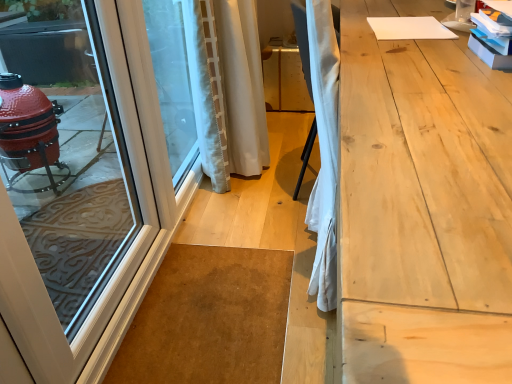
Question: Is white textured curtain at center taller than light wood workbench at right?

Choices:
 (A) yes
 (B) no

Answer: (B)

Question: Is white textured curtain at center completely or partially outside of light wood workbench at right?

Choices:
 (A) no
 (B) yes

Answer: (B)

Question: From a real-world perspective, is white textured curtain at center located higher than light wood workbench at right?

Choices:
 (A) no
 (B) yes

Answer: (A)

Question: Is white textured curtain at center thinner than light wood workbench at right?

Choices:
 (A) yes
 (B) no

Answer: (A)

Question: Is white textured curtain at center smaller than light wood workbench at right?

Choices:
 (A) yes
 (B) no

Answer: (A)

Question: Considering the relative positions of white textured curtain at center and light wood workbench at right in the image provided, is white textured curtain at center to the left of light wood workbench at right from the viewer's perspective?

Choices:
 (A) no
 (B) yes

Answer: (B)

Question: Is white textured curtain at center facing towards white glossy door at left?

Choices:
 (A) no
 (B) yes

Answer: (A)

Question: Is white textured curtain at center surrounding white glossy door at left?

Choices:
 (A) yes
 (B) no

Answer: (B)

Question: From a real-world perspective, is white textured curtain at center positioned over white glossy door at left based on gravity?

Choices:
 (A) yes
 (B) no

Answer: (B)

Question: Is white textured curtain at center taller than white glossy door at left?

Choices:
 (A) yes
 (B) no

Answer: (B)

Question: Considering the relative sizes of white textured curtain at center and white glossy door at left in the image provided, is white textured curtain at center smaller than white glossy door at left?

Choices:
 (A) no
 (B) yes

Answer: (A)

Question: Is white textured curtain at center looking in the opposite direction of white glossy door at left?

Choices:
 (A) no
 (B) yes

Answer: (A)

Question: Is white glossy door at left turned away from white textured curtain at center?

Choices:
 (A) no
 (B) yes

Answer: (A)